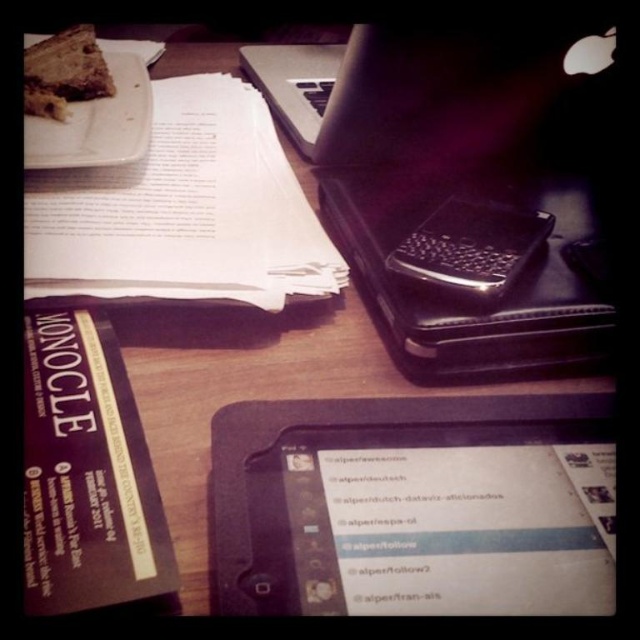
Question: Which point appears farthest from the camera in this image?

Choices:
 (A) (x=540, y=566)
 (B) (x=58, y=324)
 (C) (x=92, y=83)

Answer: (C)

Question: Estimate the real-world distances between objects in this image. Which object is farther from the black plastic phone at center?

Choices:
 (A) chocolate cake at upper left
 (B) white paper at upper left
 (C) matte black book at lower left
 (D) white plastic plate at upper left

Answer: (A)

Question: Is black matte tablet at center bigger than white paper at upper left?

Choices:
 (A) no
 (B) yes

Answer: (A)

Question: Observing the image, what is the correct spatial positioning of black matte tablet at center in reference to matte black book at lower left?

Choices:
 (A) below
 (B) above

Answer: (A)

Question: Can you confirm if matte black book at lower left is thinner than white plastic plate at upper left?

Choices:
 (A) yes
 (B) no

Answer: (A)

Question: Based on their relative distances, which object is nearer to the black matte tablet at center?

Choices:
 (A) black plastic phone at center
 (B) chocolate cake at upper left
 (C) matte black book at lower left
 (D) white paper at upper left

Answer: (C)